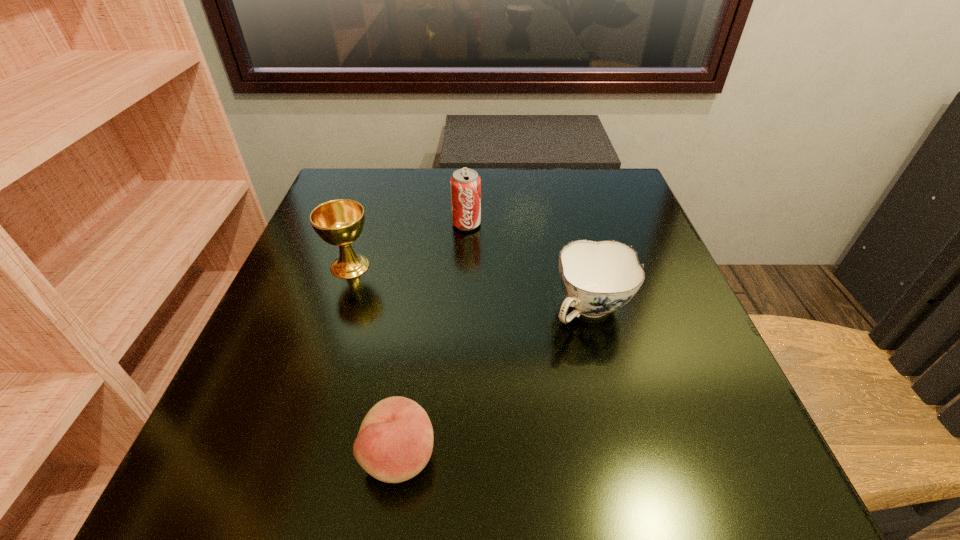
I want to click on vacant space that is in between the chinaware and the peach, so click(494, 382).

I want to click on free spot between the rightmost object and the leftmost object, so click(470, 288).

Locate an element on the screen. free spot between the rightmost object and the leftmost object is located at coordinates (470, 288).

Find the location of a particular element. The width and height of the screenshot is (960, 540). vacant point located between the leftmost object and the nearest object is located at coordinates (374, 361).

This screenshot has width=960, height=540. I want to click on vacant space that is in between the soda can and the nearest object, so click(x=433, y=340).

Locate an element on the screen. The width and height of the screenshot is (960, 540). vacant area that lies between the nearest object and the chinaware is located at coordinates (494, 382).

Identify the location of blank region between the chinaware and the soda can. Image resolution: width=960 pixels, height=540 pixels. (528, 267).

Locate an element on the screen. vacant region between the chalice and the soda can is located at coordinates (408, 245).

At what (x,y) coordinates should I click in order to perform the action: click on vacant space that is in between the leftmost object and the farthest object. Please return your answer as a coordinate pair (x, y). Looking at the image, I should click on (408, 245).

Choose which object is the third nearest neighbor to the chalice. Please provide its 2D coordinates. Your answer should be formatted as a tuple, i.e. [(x, y)], where the tuple contains the x and y coordinates of a point satisfying the conditions above.

[(597, 278)]